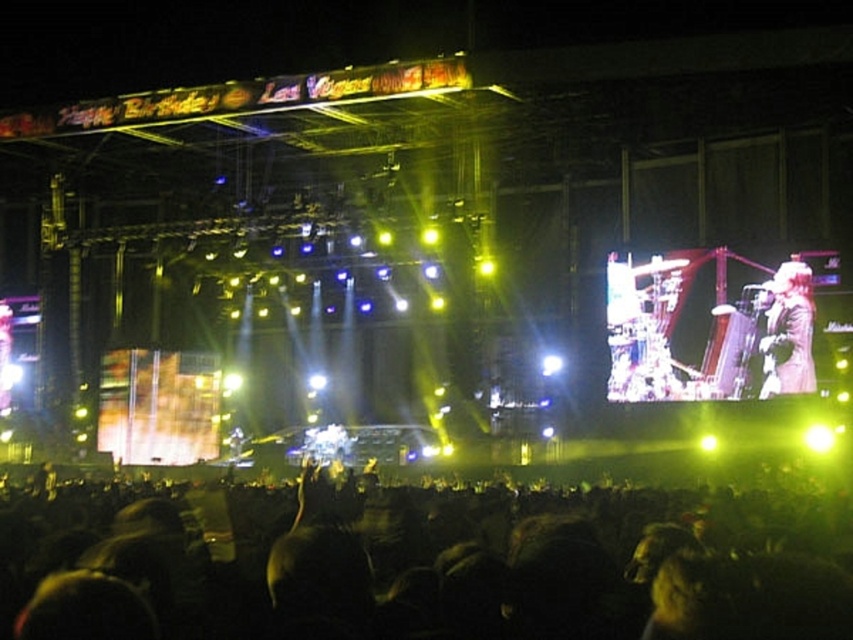
Is black matte crowd at lower center shorter than shiny black jacket at right?

Indeed, black matte crowd at lower center has a lesser height compared to shiny black jacket at right.

Between black matte crowd at lower center and shiny black jacket at right, which one is positioned higher?

shiny black jacket at right is higher up.

Does point (247, 500) come farther from viewer compared to point (798, 336)?

No.

Where is `black matte crowd at lower center`? The width and height of the screenshot is (853, 640). black matte crowd at lower center is located at coordinates (409, 563).